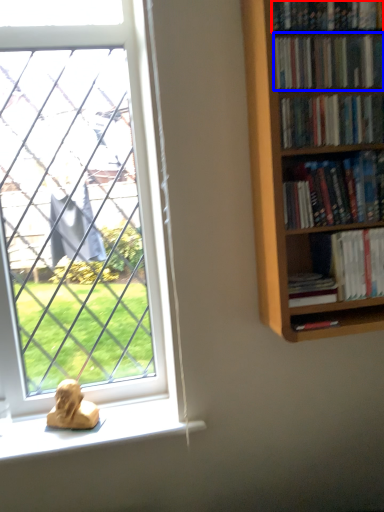
Question: Which object appears closest to the camera in this image, book (highlighted by a red box) or book (highlighted by a blue box)?

Choices:
 (A) book
 (B) book

Answer: (A)